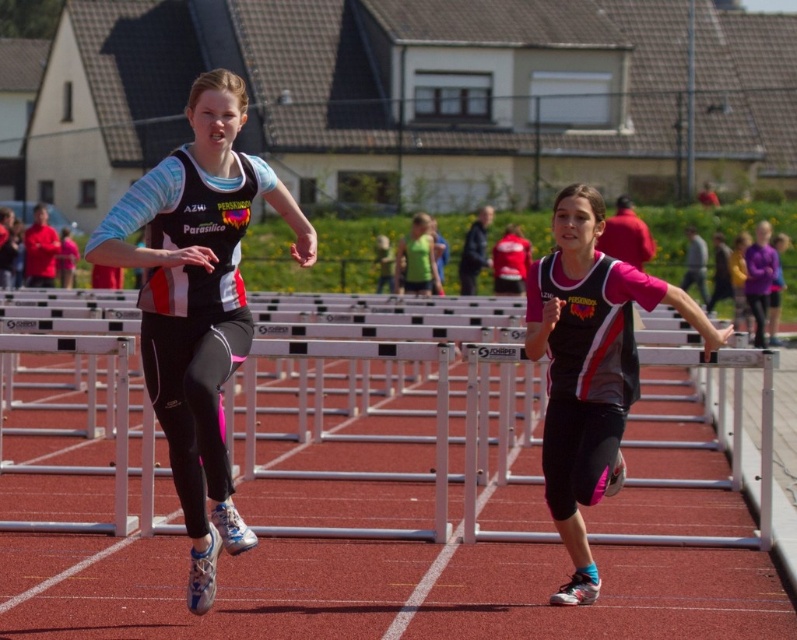
Which is behind, point (572, 541) or point (481, 362)?

The point (481, 362) is more distant.

Between pink matte shorts at center and metallic silver hurdle at center, which one is positioned higher?

pink matte shorts at center is higher up.

From the picture: Measure the distance between pink matte shorts at center and camera.

The distance of pink matte shorts at center from camera is 24.94 feet.

Find the location of `pink matte shorts at center`. pink matte shorts at center is located at coordinates pos(589,368).

Does point (495, 428) come behind point (603, 348)?

That is True.

Is point (436, 490) more distant than point (615, 456)?

Yes, it is.

You are a GUI agent. You are given a task and a screenshot of the screen. Output one action in this format:
    pyautogui.click(x=<x>, y=<y>)
    Task: Click on the white metal hurdle at center
    This screenshot has width=797, height=640.
    Given the screenshot: What is the action you would take?
    pyautogui.click(x=391, y=410)

Is matte black vest at left below metallic silver hurdle at center?

No.

Between point (238, 298) and point (658, 349), which one is positioned behind?

The point (658, 349) is more distant.

I want to click on matte black vest at left, so click(x=198, y=304).